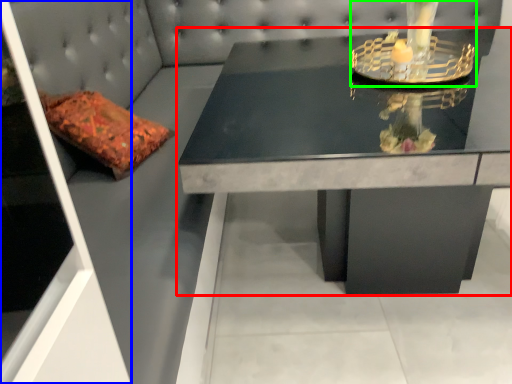
Question: Based on their relative distances, which object is nearer to table (highlighted by a red box)? Choose from glass door (highlighted by a blue box) and candle holder (highlighted by a green box).

Choices:
 (A) glass door
 (B) candle holder

Answer: (B)